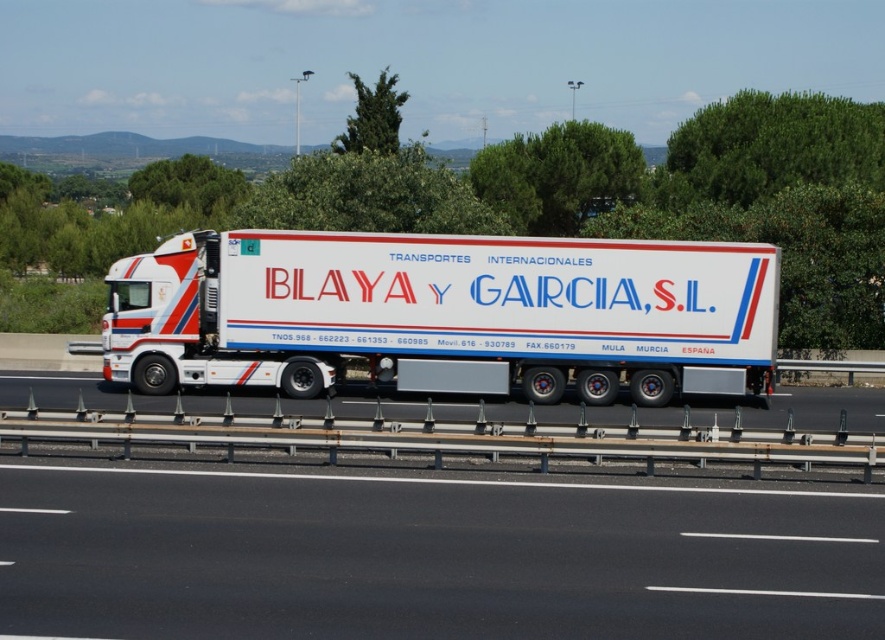
Question: Is black asphalt road at center to the left of white glossy trailer at center from the viewer's perspective?

Choices:
 (A) yes
 (B) no

Answer: (A)

Question: Observing the image, what is the correct spatial positioning of black asphalt road at center in reference to white glossy trailer at center?

Choices:
 (A) below
 (B) above

Answer: (A)

Question: Among these points, which one is farthest from the camera?

Choices:
 (A) [x=476, y=570]
 (B) [x=456, y=257]

Answer: (B)

Question: Does black asphalt road at center have a greater width compared to white glossy trailer at center?

Choices:
 (A) no
 (B) yes

Answer: (A)